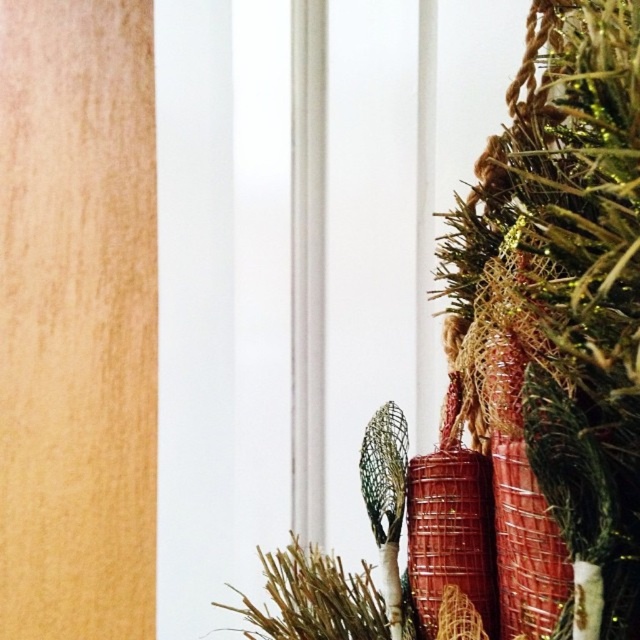
Looking at the festive Christmas tree, where is the shiny metallic ornament at upper right in relation to the shiny gold tinsel at right?

The shiny metallic ornament at upper right is positioned under the shiny gold tinsel at right.

You are a child trying to place a new decoration on the Christmas tree. You have a small star decoration that is 5 cm wide. Can you fit it between the shiny metallic ornament at upper right and the shiny gold tinsel at right without overlapping?

The shiny metallic ornament at upper right might be wider than the shiny gold tinsel at right, so there may not be enough space to fit the 5 cm wide star decoration between them without overlapping. Check the actual distance first.

You are standing 18 inches away from the Christmas tree. You want to reach the shiny metallic ornament at upper right. Can you touch it without moving closer?

The shiny metallic ornament at upper right is 16.47 inches away from the camera. Since you are standing 18 inches away from the Christmas tree, you are 1.53 inches too far to touch it without moving closer.